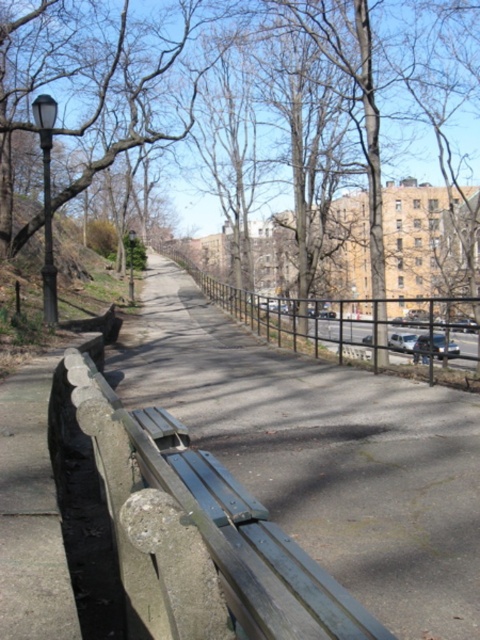
You are a city planner designing a new pathway in the park. You need to place a new bench between the brown leafless tree at upper center and the black metal fence at center. Given that the bench requires at least 10 feet of space to be comfortable, do you think there is enough space between them?

The brown leafless tree at upper center and the black metal fence at center are 27.07 feet apart from each other, so yes, there is enough space to place the bench between them as the required 10 feet is comfortably accommodated within the 27.07 feet distance.

You are a pedestrian standing on the pathway and want to sit down. You see the concrete bench at center and the black metal fence at center. Which object is closer to your left side?

The concrete bench at center is to the left of the black metal fence at center, so the concrete bench at center is closer to your left side.

You are a city planner assessing the park layout. You need to determine if there is enough space between the concrete bench at center and the black metal fence at center to place a small flower bed. Based on their sizes, can you confirm if this is feasible?

The concrete bench at center occupies less space than the black metal fence at center, so there is sufficient space between them to place a small flower bed.